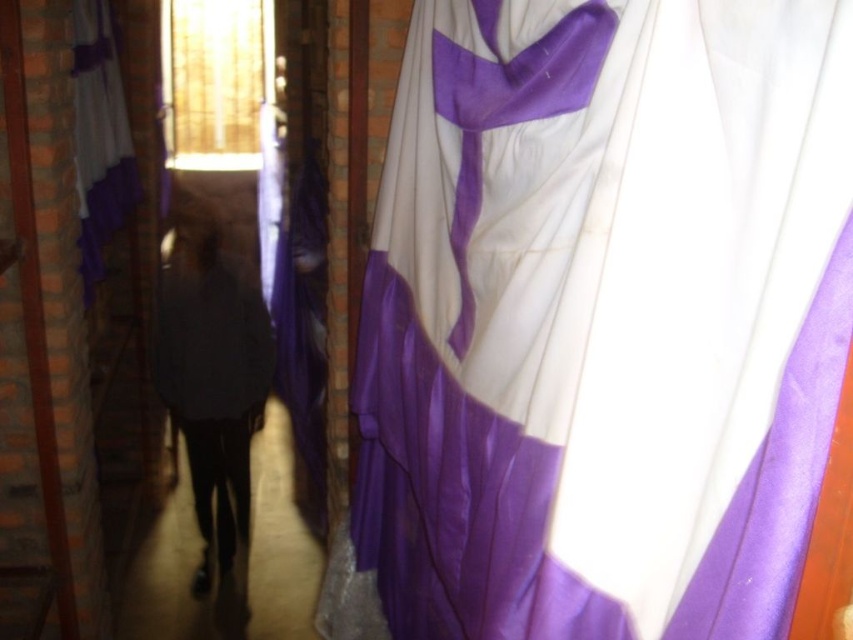
Question: Among these points, which one is farthest from the camera?

Choices:
 (A) (596, 580)
 (B) (158, 362)

Answer: (B)

Question: Is purple satin curtain at center thinner than purple satin curtain at left?

Choices:
 (A) yes
 (B) no

Answer: (B)

Question: Which object appears closest to the camera in this image?

Choices:
 (A) purple satin curtain at center
 (B) matte black robe at center

Answer: (A)

Question: Which point is closer to the camera?

Choices:
 (A) purple satin curtain at center
 (B) matte black robe at center

Answer: (A)

Question: From the image, what is the correct spatial relationship of purple satin curtain at center in relation to matte black robe at center?

Choices:
 (A) below
 (B) above

Answer: (B)

Question: Is matte black robe at center to the right of purple satin curtain at left from the viewer's perspective?

Choices:
 (A) no
 (B) yes

Answer: (B)